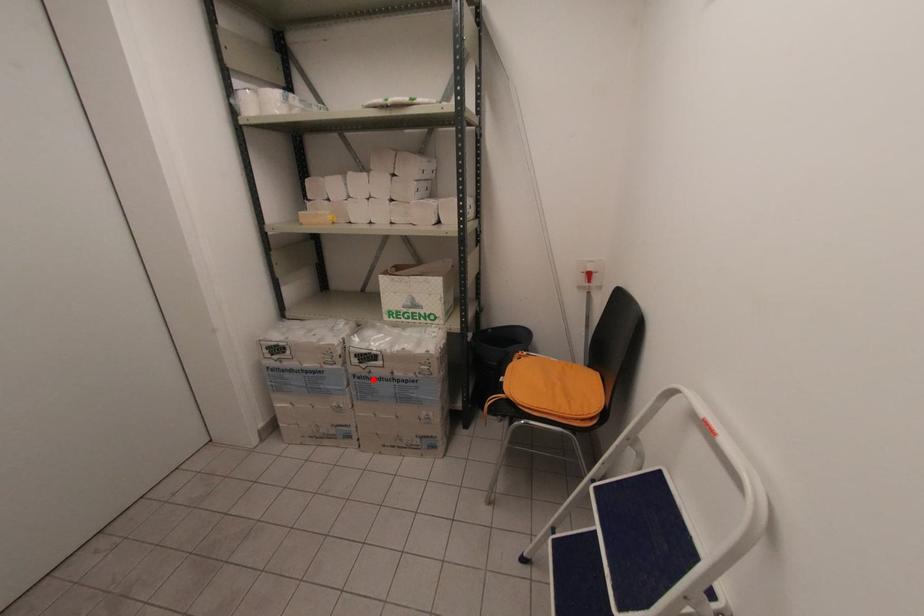
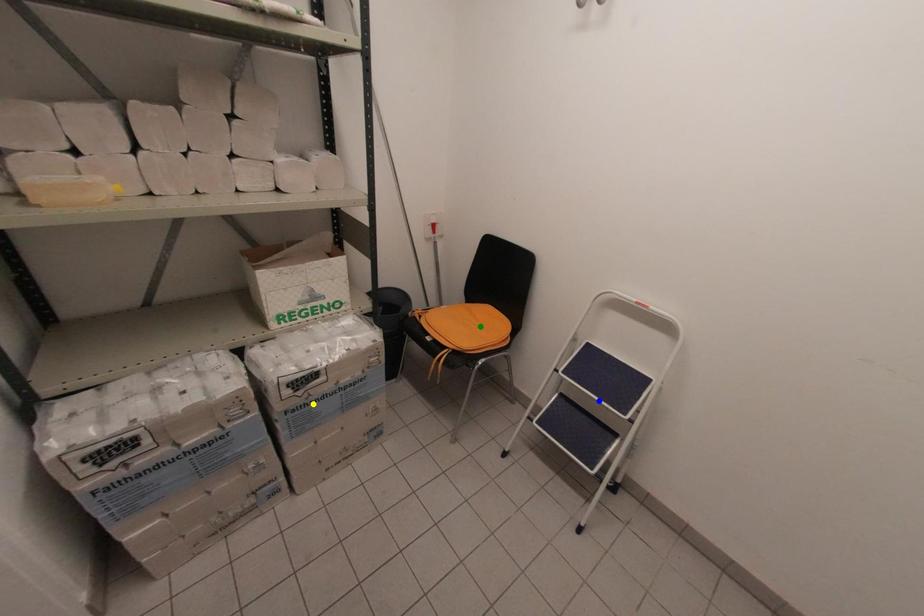
Question: I am providing you with two images of the same scene from different viewpoints. A red point is marked on the first image. You are given multiple points on the second image. Which spot in image 2 lines up with the point in image 1?

Choices:
 (A) blue point
 (B) green point
 (C) yellow point

Answer: (C)